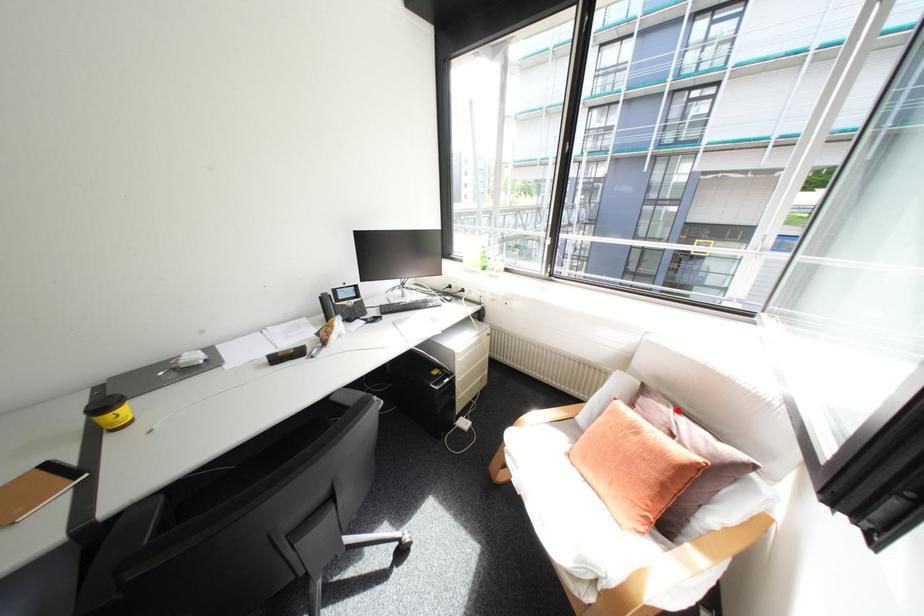
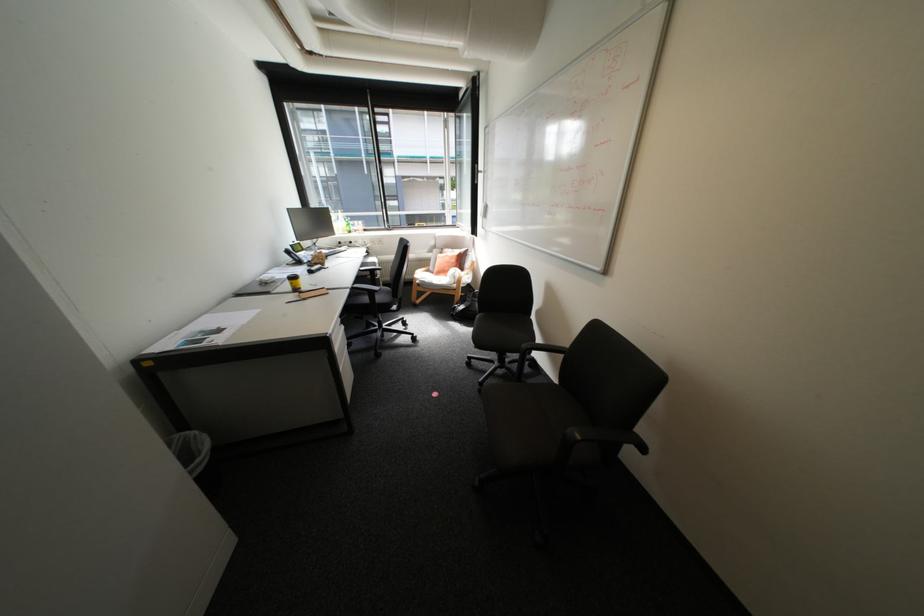
Question: I am providing you with two images of the same scene from different viewpoints. In image1, a red point is highlighted. Considering the same 3D point in image2, which of the following is correct?

Choices:
 (A) It is closer
 (B) It is farther

Answer: (A)